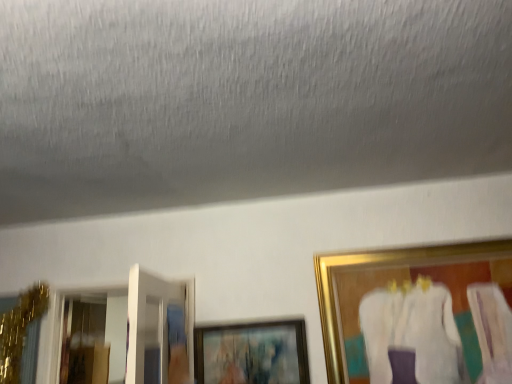
Question: Considering the positions of point (478, 251) and point (289, 379), is point (478, 251) closer or farther from the camera than point (289, 379)?

Choices:
 (A) closer
 (B) farther

Answer: (B)

Question: From a real-world perspective, relative to matte black picture frame at center, which ranks as the 2th picture frame in right-to-left order, is gold-framed painting at right, positioned as the second picture frame in left-to-right order, vertically above or below?

Choices:
 (A) above
 (B) below

Answer: (A)

Question: Is gold-framed painting at right, positioned as the second picture frame in left-to-right order, taller or shorter than matte black picture frame at center, which ranks as the 2th picture frame in right-to-left order?

Choices:
 (A) tall
 (B) short

Answer: (A)

Question: Considering the relative positions of matte black picture frame at center, the first picture frame from the left, and gold-framed painting at right, which is the first picture frame from right to left, in the image provided, is matte black picture frame at center, the first picture frame from the left, to the left or to the right of gold-framed painting at right, which is the first picture frame from right to left,?

Choices:
 (A) right
 (B) left

Answer: (B)

Question: Looking at their shapes, would you say matte black picture frame at center, the first picture frame from the left, is wider or thinner than gold-framed painting at right, which is the first picture frame from right to left?

Choices:
 (A) thin
 (B) wide

Answer: (A)

Question: From the image's perspective, is matte black picture frame at center, the first picture frame from the left, positioned above or below gold-framed painting at right, which is the first picture frame from right to left?

Choices:
 (A) below
 (B) above

Answer: (A)

Question: Is matte black picture frame at center, which ranks as the 2th picture frame in right-to-left order, spatially inside gold-framed painting at right, which is the first picture frame from right to left, or outside of it?

Choices:
 (A) outside
 (B) inside

Answer: (A)